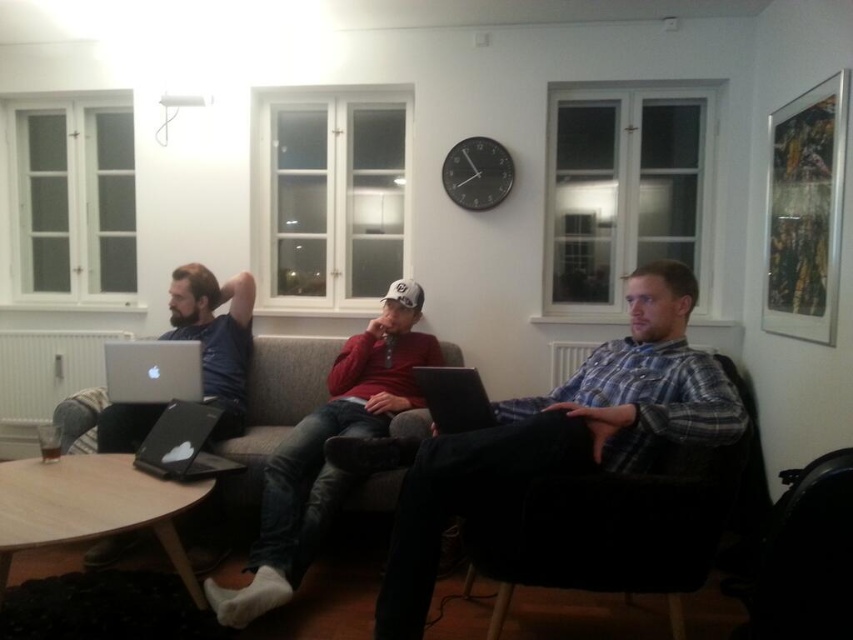
You are a delivery robot with a package that needs to be placed between the red knit sweater at center and the silver metallic laptop at left. The package is 25 inches long. Will it fit in the space between them?

The space between the red knit sweater at center and the silver metallic laptop at left is 26.12 inches. Since the package is 25 inches long, it will fit in the space between them.

You are a delivery person entering the room and need to place a package on the nearest object between the red knit sweater at center and the silver metallic laptop at left. Which object should you choose?

The red knit sweater at center is closer to the viewer than the silver metallic laptop at left, so you should place the package on the red knit sweater at center.